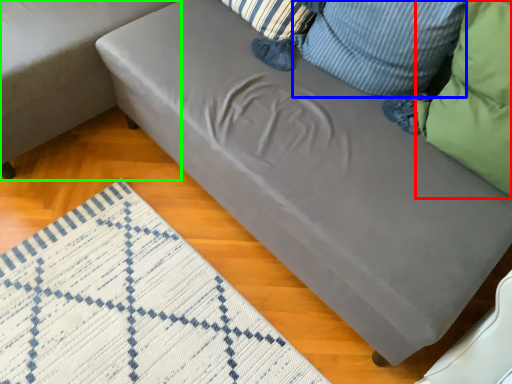
Question: Which object is the farthest from pillow (highlighted by a red box)? Choose among these: pillow (highlighted by a blue box) or studio couch (highlighted by a green box).

Choices:
 (A) pillow
 (B) studio couch

Answer: (B)